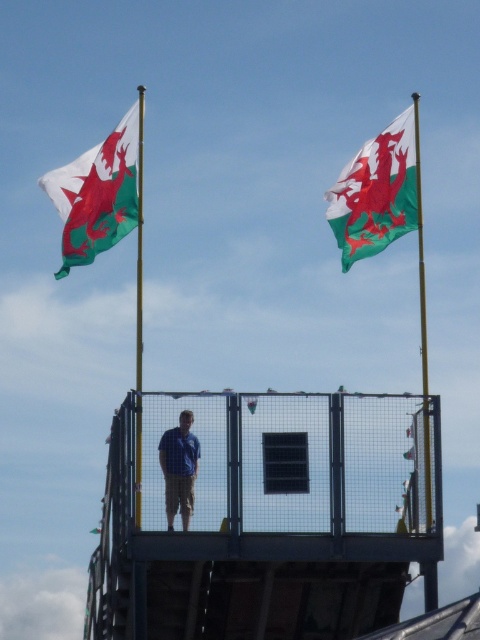
Question: Can you confirm if green and white fabric flag at upper right is bigger than blue shirt at center?

Choices:
 (A) no
 (B) yes

Answer: (B)

Question: Which object is the farthest from the yellow metallic flag pole at right?

Choices:
 (A) green/white fabric flag at upper left
 (B) blue shirt at center
 (C) green and white fabric flag at upper right

Answer: (B)

Question: Can you confirm if green and white fabric flag at upper right is thinner than green/white fabric flag at upper left?

Choices:
 (A) yes
 (B) no

Answer: (A)

Question: Which point appears farthest from the camera in this image?

Choices:
 (A) (420, 317)
 (B) (408, 170)
 (C) (173, 496)
 (D) (81, 216)

Answer: (A)

Question: Is green/white fabric flag at upper left to the left of yellow metallic flag pole at right from the viewer's perspective?

Choices:
 (A) yes
 (B) no

Answer: (A)

Question: Which object is farther from the camera taking this photo?

Choices:
 (A) green/white fabric flag at upper left
 (B) blue shirt at center
 (C) yellow metallic flag pole at right
 (D) green and white fabric flag at upper right

Answer: (A)